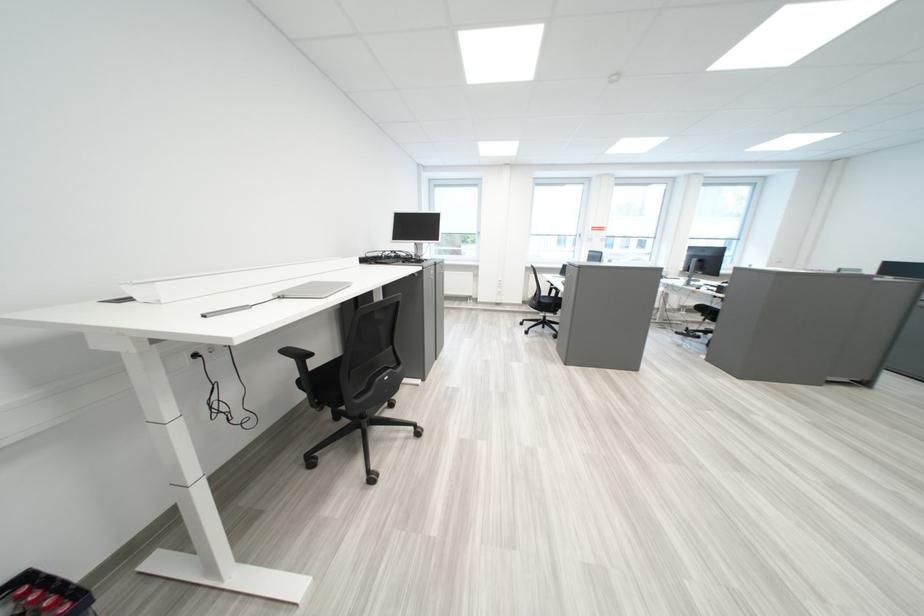
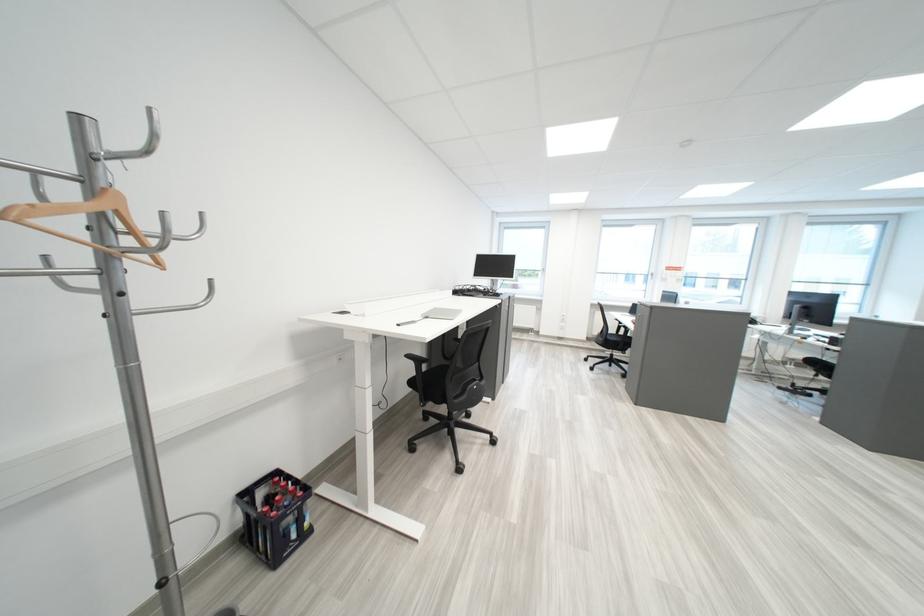
Where in the second image is the point corresponding to pixel 300 352 from the first image?

(421, 358)